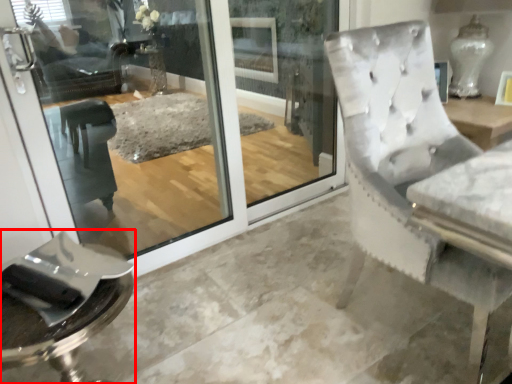
Question: From the image's perspective, where is furniture (annotated by the red box) located relative to screen door?

Choices:
 (A) above
 (B) below

Answer: (B)